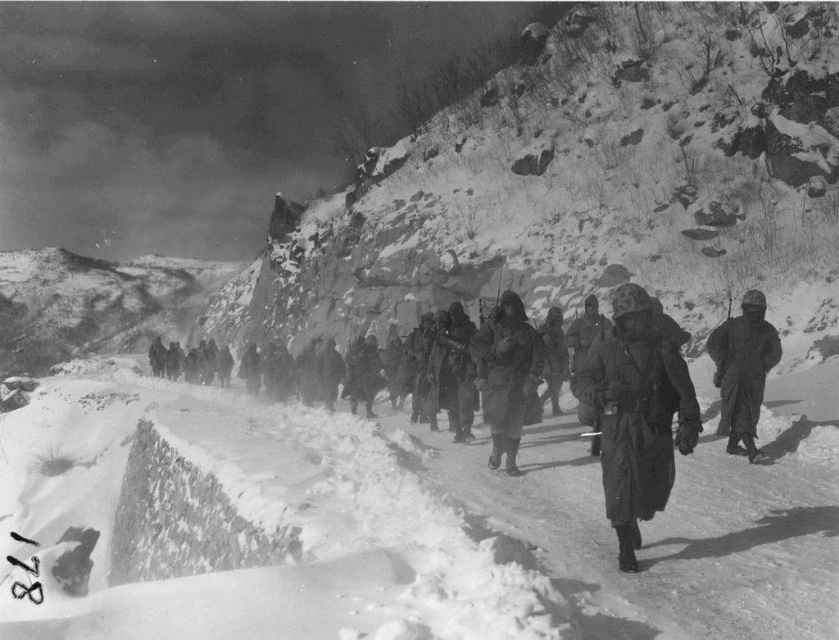
You are a soldier in the group marching towards the camera. You notice two points marked on the path ahead. The first is at point (602, 230) and the second is at point (758, 358). Which point is closer to your current position?

Point (602, 230) is further to the camera than point (758, 358). Since you are marching towards the camera, the point closer to your current position would be the one further away from the camera, which is point (758, 358).

You are a photographer positioned at the edge of the snowy mountain path. You want to capture a photo of the rocky snow at center and the dark gray woolen coat at center in the same frame. Given that your camera has a maximum focus range of 150 feet, will both subjects be in focus?

The rocky snow at center and dark gray woolen coat at center are 173.75 feet apart. Since the camera can only focus up to 150 feet, the distance between them exceeds the maximum focus range. Therefore, both subjects cannot be in focus simultaneously.

You are a photographer standing at the edge of a snowy mountain path. You want to take a photo of the white powdery snow at center and the dark gray woolen coat at center in the same frame. Given that your camera has a maximum focus range of 20 meters, will both objects be in focus?

The white powdery snow at center and dark gray woolen coat at center are 21.98 meters apart from each other. Since the distance between them exceeds the camera maximum focus range of 20 meters, both objects cannot be in focus simultaneously.